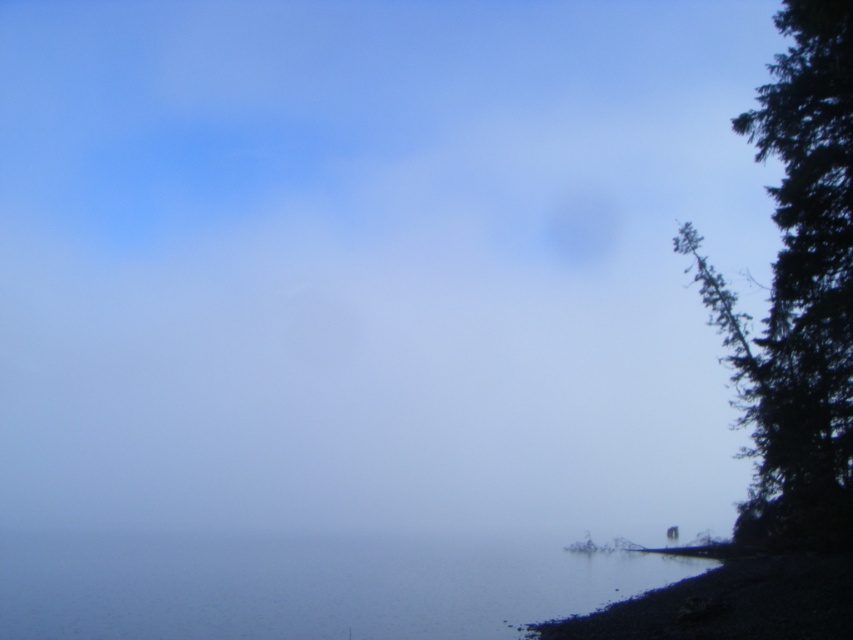
Question: Among these points, which one is nearest to the camera?

Choices:
 (A) (548, 573)
 (B) (688, 634)

Answer: (B)

Question: Which is farther from the clear water at lower right?

Choices:
 (A) smooth pebbles at lower right
 (B) dark green textured tree at right

Answer: (B)

Question: Does dark green textured tree at right have a greater width compared to smooth pebbles at lower right?

Choices:
 (A) yes
 (B) no

Answer: (A)

Question: Is dark green textured tree at right further to camera compared to smooth pebbles at lower right?

Choices:
 (A) yes
 (B) no

Answer: (B)

Question: Based on their relative distances, which object is nearer to the clear water at lower right?

Choices:
 (A) smooth pebbles at lower right
 (B) dark green textured tree at right

Answer: (A)

Question: Is dark green textured tree at right to the right of smooth pebbles at lower right from the viewer's perspective?

Choices:
 (A) no
 (B) yes

Answer: (B)